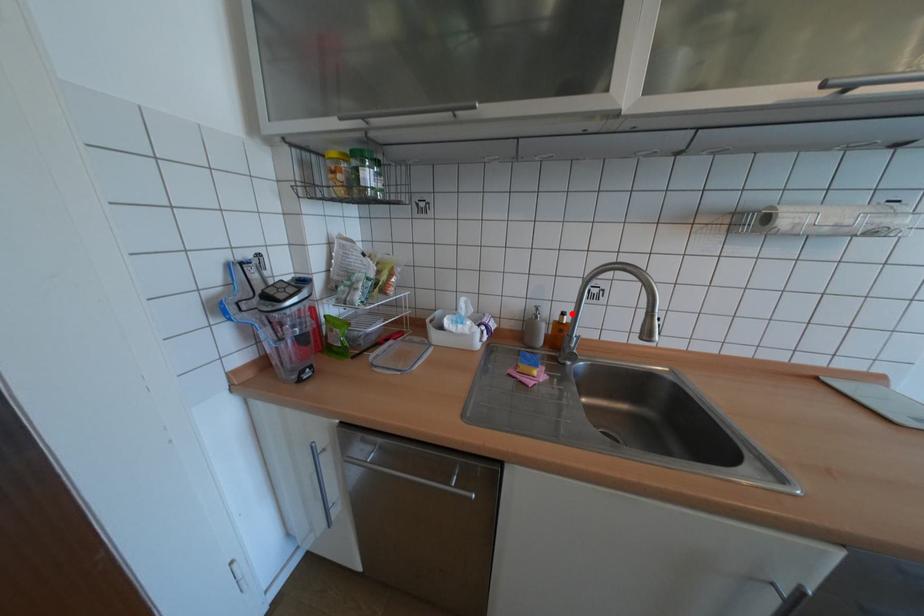
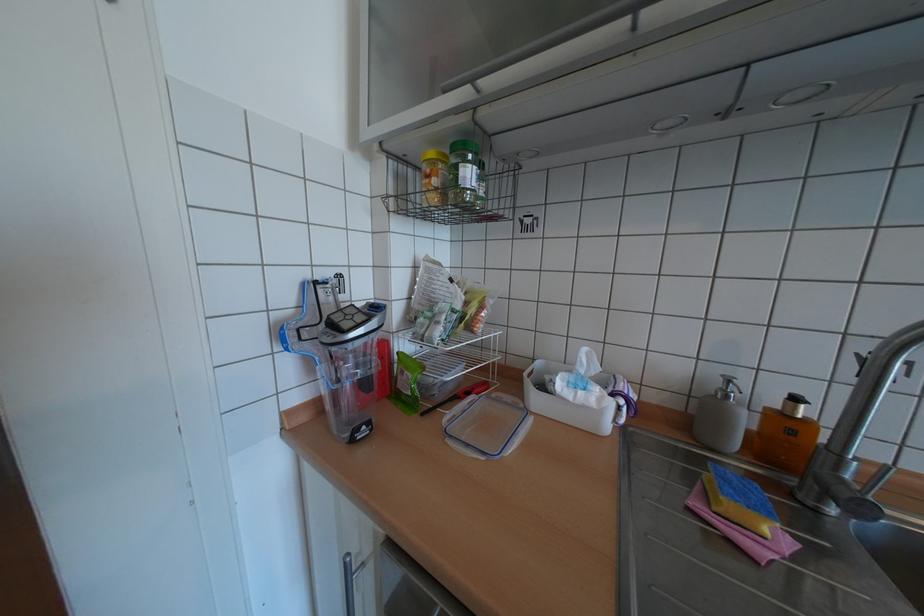
The point at the highlighted location is marked in the first image. Where is the corresponding point in the second image?

(805, 399)